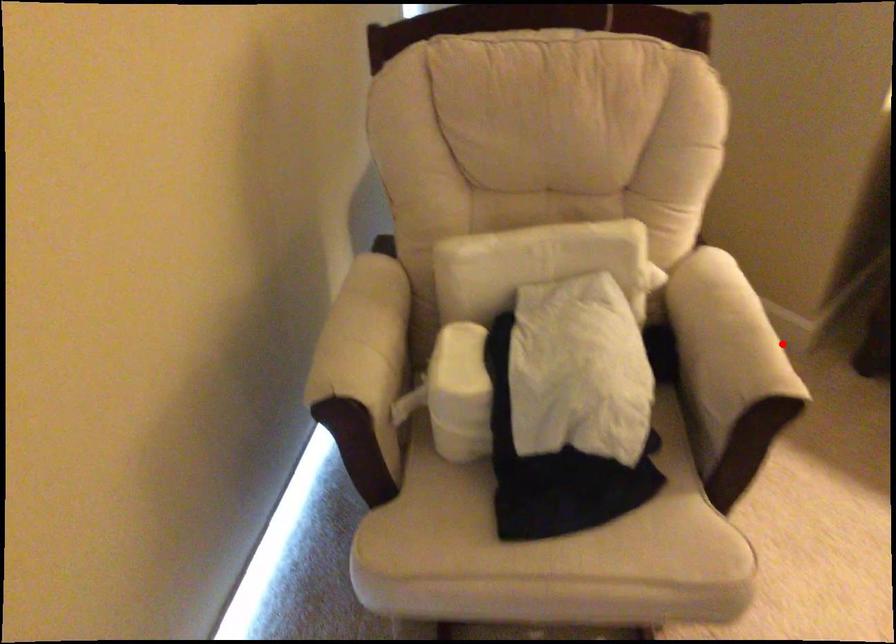
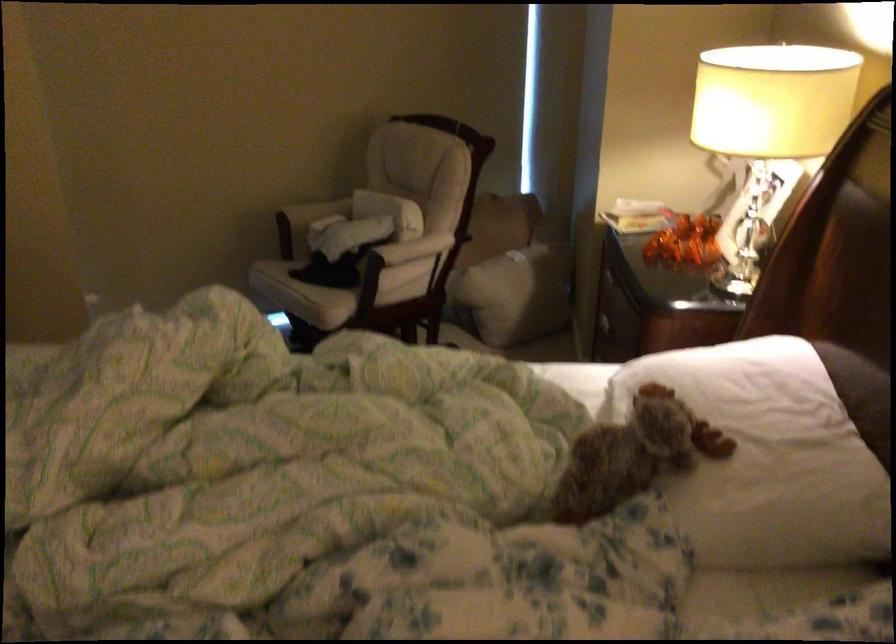
Locate, in the second image, the point that corresponds to the highlighted location in the first image.

(415, 250)